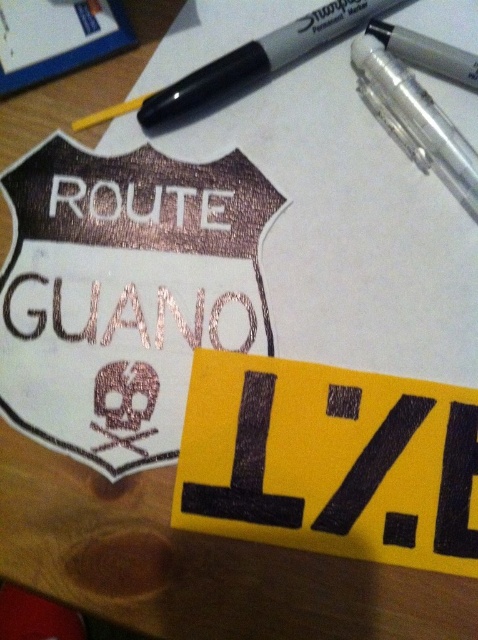
Question: Which object is positioned closest to the yellow matte sign at lower right?

Choices:
 (A) rose gold metallic sign at upper center
 (B) metallic black marker at upper center
 (C) clear plastic pen at upper right

Answer: (A)

Question: Where is rose gold metallic sign at upper center located in relation to clear plastic pen at upper right in the image?

Choices:
 (A) left
 (B) right

Answer: (A)

Question: Which point is closer to the camera taking this photo?

Choices:
 (A) (332, 16)
 (B) (326, 420)
 (C) (224, 157)

Answer: (B)

Question: Does rose gold metallic sign at upper center have a smaller size compared to metallic black marker at upper center?

Choices:
 (A) no
 (B) yes

Answer: (A)

Question: Which of the following is the closest to the observer?

Choices:
 (A) click(257, 420)
 (B) click(325, 12)

Answer: (A)

Question: In this image, where is rose gold metallic sign at upper center located relative to clear plastic pen at upper right?

Choices:
 (A) right
 (B) left

Answer: (B)